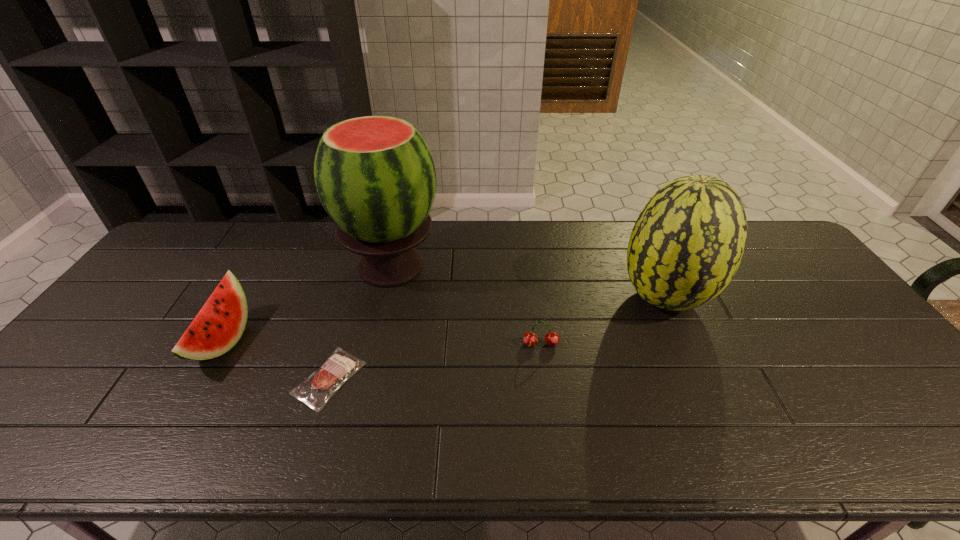
The image size is (960, 540). I want to click on empty space between the second watermelon from left to right and the fourth tallest object, so click(x=467, y=306).

Find the location of a particular element. The height and width of the screenshot is (540, 960). blank region between the cherry and the shortest watermelon is located at coordinates (382, 343).

This screenshot has width=960, height=540. Find the location of `free spot between the leftmost object and the second watermelon from left to right`. free spot between the leftmost object and the second watermelon from left to right is located at coordinates (307, 304).

This screenshot has height=540, width=960. Find the location of `vacant region between the second watermelon from left to right and the third shortest object`. vacant region between the second watermelon from left to right and the third shortest object is located at coordinates (307, 304).

The height and width of the screenshot is (540, 960). Find the location of `free space between the second watermelon from right to left and the rightmost object`. free space between the second watermelon from right to left and the rightmost object is located at coordinates (528, 282).

The width and height of the screenshot is (960, 540). Find the location of `unoccupied area between the cherry and the third shortest object`. unoccupied area between the cherry and the third shortest object is located at coordinates (382, 343).

The image size is (960, 540). Find the location of `free area in between the shortest object and the second object from right to left`. free area in between the shortest object and the second object from right to left is located at coordinates (435, 361).

The image size is (960, 540). In order to click on vacant area that lies between the second shortest watermelon and the fourth tallest object in this screenshot , I will do `click(603, 321)`.

The image size is (960, 540). What are the coordinates of `free space between the second shortest watermelon and the cherry` in the screenshot? It's located at click(x=603, y=321).

You are a GUI agent. You are given a task and a screenshot of the screen. Output one action in this format:
    pyautogui.click(x=<x>, y=<y>)
    Task: Click on the object that stands as the second closest to the rightmost object
    
    Given the screenshot: What is the action you would take?
    pyautogui.click(x=375, y=176)